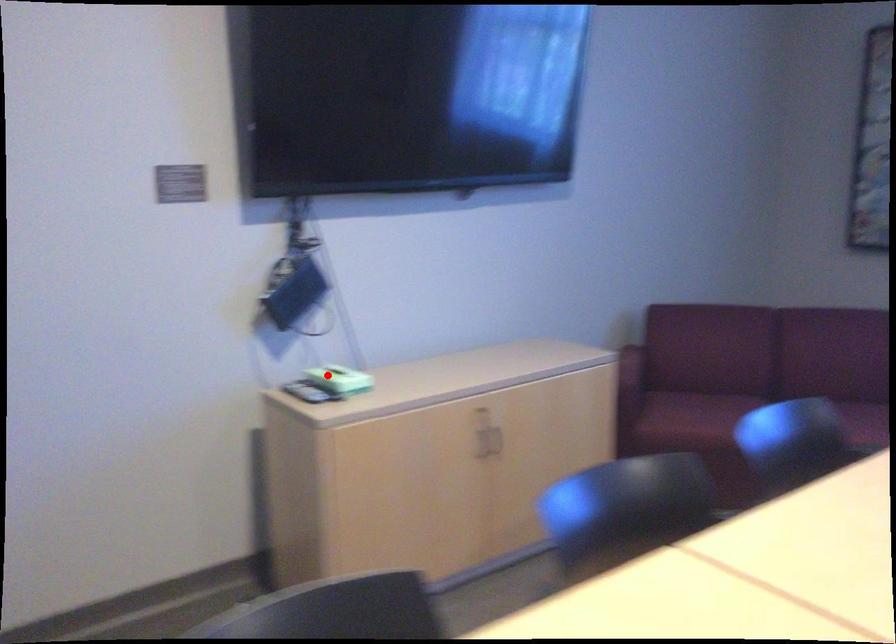
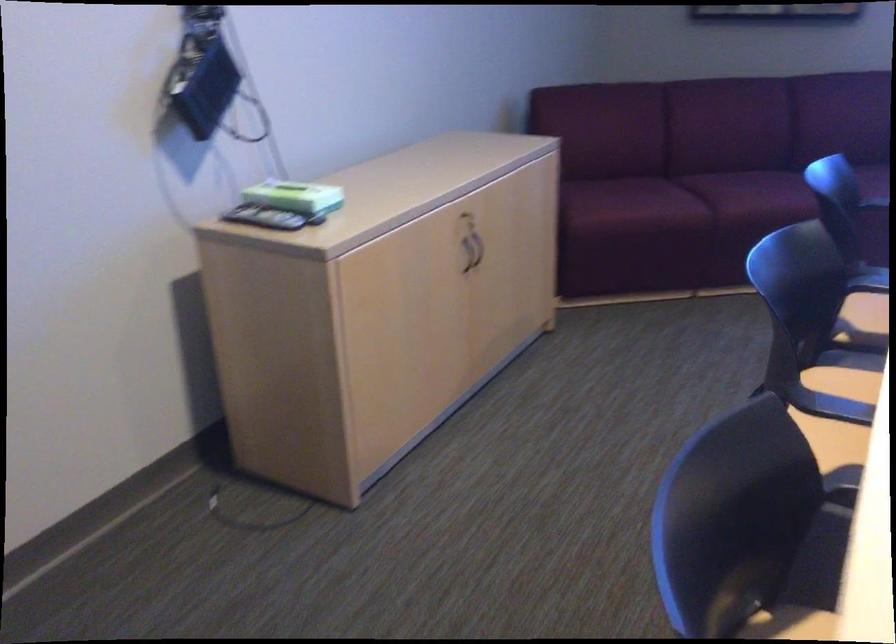
Where in the second image is the point corresponding to the highlighted location from the first image?

(287, 196)